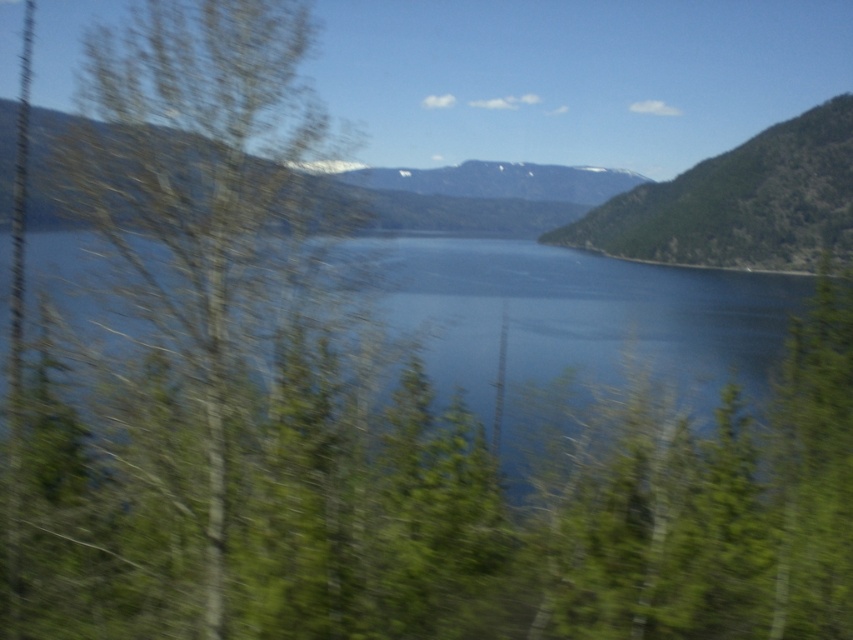
Question: Can you confirm if blue water at center is positioned above green textured hillside at upper right?

Choices:
 (A) yes
 (B) no

Answer: (B)

Question: Which is farther from the green leafy tree at left?

Choices:
 (A) green textured hillside at upper right
 (B) blue water at center

Answer: (A)

Question: Does green leafy tree at left appear on the left side of blue water at center?

Choices:
 (A) no
 (B) yes

Answer: (B)

Question: Which object is positioned closest to the blue water at center?

Choices:
 (A) green textured hillside at upper right
 (B) green leafy tree at left

Answer: (B)

Question: Is blue water at center wider than green textured hillside at upper right?

Choices:
 (A) no
 (B) yes

Answer: (A)

Question: Which object is closer to the camera taking this photo?

Choices:
 (A) green textured hillside at upper right
 (B) green leafy tree at left
 (C) blue water at center

Answer: (B)